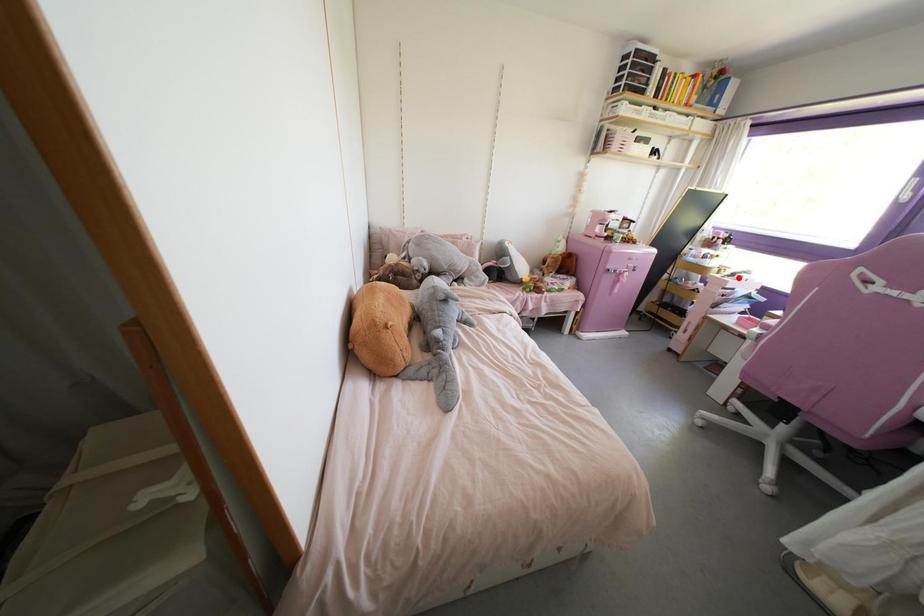
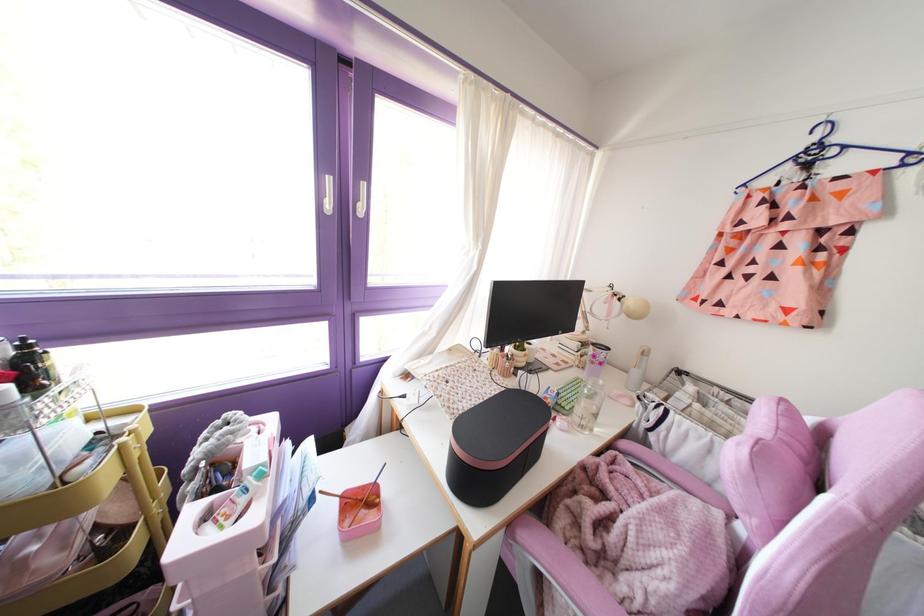
Find the pixel in the second image that matches the highlighted location in the first image.

(261, 475)